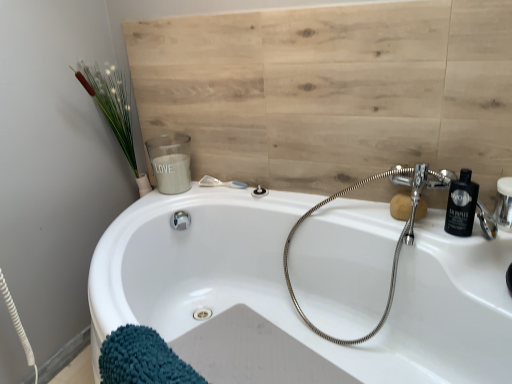
Locate an element on the screen. Image resolution: width=512 pixels, height=384 pixels. matte silver shower at upper center, the second shower when ordered from left to right is located at coordinates (259, 192).

What do you see at coordinates (259, 192) in the screenshot? I see `matte silver shower at upper center, the second shower when ordered from left to right` at bounding box center [259, 192].

The image size is (512, 384). Describe the element at coordinates (220, 183) in the screenshot. I see `clear plastic shower at upper center, placed as the first shower when sorted from left to right` at that location.

Describe the element at coordinates (461, 205) in the screenshot. The height and width of the screenshot is (384, 512). I see `black plastic bottle at upper right` at that location.

Find the location of `white matte candle at upper left`. white matte candle at upper left is located at coordinates (172, 173).

Identify the location of white glossy bathtub at center. (310, 282).

Is black plastic bottle at upper right turned away from matte silver shower at upper center, marked as the first shower in a right-to-left arrangement?

black plastic bottle at upper right is not turned away from matte silver shower at upper center, marked as the first shower in a right-to-left arrangement.

Would you say black plastic bottle at upper right is outside matte silver shower at upper center, the second shower when ordered from left to right?

black plastic bottle at upper right lies outside matte silver shower at upper center, the second shower when ordered from left to right,'s area.

From a real-world perspective, is black plastic bottle at upper right below matte silver shower at upper center, the second shower when ordered from left to right?

No, from a real-world perspective, black plastic bottle at upper right is not beneath matte silver shower at upper center, the second shower when ordered from left to right.

Relative to matte silver shower at upper center, marked as the first shower in a right-to-left arrangement, is black plastic bottle at upper right in front or behind?

In the image, black plastic bottle at upper right appears in front of matte silver shower at upper center, marked as the first shower in a right-to-left arrangement.

Image resolution: width=512 pixels, height=384 pixels. Find the location of `liquid that is above the chrome flexible hose at upper right (from a real-world perspective)`. liquid that is above the chrome flexible hose at upper right (from a real-world perspective) is located at coordinates (172, 173).

From the image's perspective, is white matte candle at upper left located beneath chrome flexible hose at upper right?

Incorrect, from the image's perspective, white matte candle at upper left is higher than chrome flexible hose at upper right.

Is chrome flexible hose at upper right inside white matte candle at upper left?

No, chrome flexible hose at upper right is located outside of white matte candle at upper left.

In the image, is white matte candle at upper left on the left side or the right side of chrome flexible hose at upper right?

white matte candle at upper left is to the left of chrome flexible hose at upper right.

Between white glossy bathtub at center and white matte candle at upper left, which one appears on the right side from the viewer's perspective?

From the viewer's perspective, white glossy bathtub at center appears more on the right side.

Is white glossy bathtub at center positioned with its back to white matte candle at upper left?

No, white matte candle at upper left is not at the back of white glossy bathtub at center.

Measure the distance from white glossy bathtub at center to white matte candle at upper left.

white glossy bathtub at center is 20.97 inches from white matte candle at upper left.

From the image's perspective, does white glossy bathtub at center appear higher than white matte candle at upper left?

No, from the image's perspective, white glossy bathtub at center is not above white matte candle at upper left.

Would you say white glossy bathtub at center is inside or outside black plastic bottle at upper right?

white glossy bathtub at center is outside black plastic bottle at upper right.

Image resolution: width=512 pixels, height=384 pixels. I want to click on soap dispenser that is on the right side of white glossy bathtub at center, so click(x=461, y=205).

Considering the relative sizes of white glossy bathtub at center and black plastic bottle at upper right in the image provided, is white glossy bathtub at center bigger than black plastic bottle at upper right?

Yes, white glossy bathtub at center is bigger than black plastic bottle at upper right.

Between white glossy bathtub at center and black plastic bottle at upper right, which one has more height?

With more height is white glossy bathtub at center.

Is the surface of white matte candle at upper left in direct contact with matte silver shower at upper center, marked as the first shower in a right-to-left arrangement?

No, white matte candle at upper left is not beside matte silver shower at upper center, marked as the first shower in a right-to-left arrangement.

From the image's perspective, is white matte candle at upper left positioned above or below matte silver shower at upper center, marked as the first shower in a right-to-left arrangement?

From the image's perspective, white matte candle at upper left appears above matte silver shower at upper center, marked as the first shower in a right-to-left arrangement.

Is white matte candle at upper left located outside matte silver shower at upper center, the second shower when ordered from left to right?

Indeed, white matte candle at upper left is completely outside matte silver shower at upper center, the second shower when ordered from left to right.

How far apart are white matte candle at upper left and matte silver shower at upper center, the second shower when ordered from left to right?

white matte candle at upper left is 13.25 inches away from matte silver shower at upper center, the second shower when ordered from left to right.

Is point (236, 185) closer or farther from the camera than point (254, 193)?

Point (236, 185).

The width and height of the screenshot is (512, 384). Identify the location of shower on the right of the clear plastic shower at upper center, the second shower in the right-to-left sequence. (259, 192).

Considering the sizes of objects clear plastic shower at upper center, placed as the first shower when sorted from left to right, and matte silver shower at upper center, marked as the first shower in a right-to-left arrangement, in the image provided, who is taller, clear plastic shower at upper center, placed as the first shower when sorted from left to right, or matte silver shower at upper center, marked as the first shower in a right-to-left arrangement,?

matte silver shower at upper center, marked as the first shower in a right-to-left arrangement, is taller.

Measure the distance between clear plastic shower at upper center, placed as the first shower when sorted from left to right, and matte silver shower at upper center, marked as the first shower in a right-to-left arrangement.

5.26 inches.

Are white glossy bathtub at center and chrome flexible hose at upper right located far from each other?

white glossy bathtub at center is near chrome flexible hose at upper right, not far away.

Considering the relative sizes of white glossy bathtub at center and chrome flexible hose at upper right in the image provided, is white glossy bathtub at center bigger than chrome flexible hose at upper right?

Yes, white glossy bathtub at center is bigger than chrome flexible hose at upper right.

From a real-world perspective, is white glossy bathtub at center physically below chrome flexible hose at upper right?

Yes.

From the picture: Does white glossy bathtub at center come in front of chrome flexible hose at upper right?

Yes, white glossy bathtub at center is in front of chrome flexible hose at upper right.

Which shower is the 1st one when counting from the back of the black plastic bottle at upper right? Please provide its 2D coordinates.

[(259, 192)]

The width and height of the screenshot is (512, 384). I want to click on plumbing fixture lying below the white matte candle at upper left (from the image's perspective), so click(398, 239).

Based on the photo, based on their spatial positions, is black plastic bottle at upper right or clear plastic shower at upper center, the second shower in the right-to-left sequence, closer to matte silver shower at upper center, the second shower when ordered from left to right?

Based on the image, clear plastic shower at upper center, the second shower in the right-to-left sequence, appears to be nearer to matte silver shower at upper center, the second shower when ordered from left to right.

From the picture: Looking at the image, which one is located closer to white glossy bathtub at center, clear plastic shower at upper center, the second shower in the right-to-left sequence, or matte silver shower at upper center, marked as the first shower in a right-to-left arrangement?

matte silver shower at upper center, marked as the first shower in a right-to-left arrangement.

Looking at the image, which one is located further to white matte candle at upper left, white glossy bathtub at center or matte silver shower at upper center, the second shower when ordered from left to right?

white glossy bathtub at center is further to white matte candle at upper left.

Looking at the image, which one is located closer to clear plastic shower at upper center, the second shower in the right-to-left sequence, white matte candle at upper left or white glossy bathtub at center?

white matte candle at upper left is positioned closer to the anchor clear plastic shower at upper center, the second shower in the right-to-left sequence.

Estimate the real-world distances between objects in this image. Which object is further from matte silver shower at upper center, the second shower when ordered from left to right, white glossy bathtub at center or black plastic bottle at upper right?

black plastic bottle at upper right is further to matte silver shower at upper center, the second shower when ordered from left to right.

Looking at the image, which one is located further to clear plastic shower at upper center, placed as the first shower when sorted from left to right, matte silver shower at upper center, the second shower when ordered from left to right, or white matte candle at upper left?

white matte candle at upper left is further to clear plastic shower at upper center, placed as the first shower when sorted from left to right.

Estimate the real-world distances between objects in this image. Which object is further from matte silver shower at upper center, the second shower when ordered from left to right, chrome flexible hose at upper right or white matte candle at upper left?

The object further to matte silver shower at upper center, the second shower when ordered from left to right, is chrome flexible hose at upper right.

Looking at the image, which one is located further to clear plastic shower at upper center, placed as the first shower when sorted from left to right, black plastic bottle at upper right or white glossy bathtub at center?

black plastic bottle at upper right is positioned further to the anchor clear plastic shower at upper center, placed as the first shower when sorted from left to right.

The image size is (512, 384). What are the coordinates of `shower between chrome flexible hose at upper right and clear plastic shower at upper center, the second shower in the right-to-left sequence, along the z-axis` in the screenshot? It's located at (259, 192).

Find the location of `plumbing fixture located between clear plastic shower at upper center, the second shower in the right-to-left sequence, and black plastic bottle at upper right in the left-right direction`. plumbing fixture located between clear plastic shower at upper center, the second shower in the right-to-left sequence, and black plastic bottle at upper right in the left-right direction is located at coordinates (x=398, y=239).

At what (x,y) coordinates should I click in order to perform the action: click on plumbing fixture between white glossy bathtub at center and black plastic bottle at upper right along the z-axis. Please return your answer as a coordinate pair (x, y). Looking at the image, I should click on (398, 239).

You are a GUI agent. You are given a task and a screenshot of the screen. Output one action in this format:
    pyautogui.click(x=<x>, y=<y>)
    Task: Click on the plumbing fixture between white glossy bathtub at center and white matte candle at upper left from front to back
    
    Given the screenshot: What is the action you would take?
    pyautogui.click(x=398, y=239)